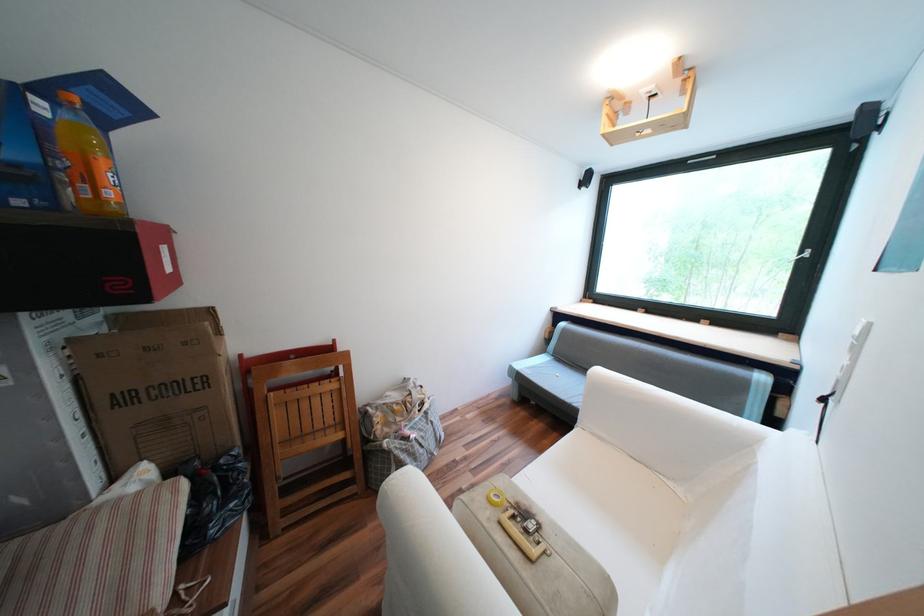
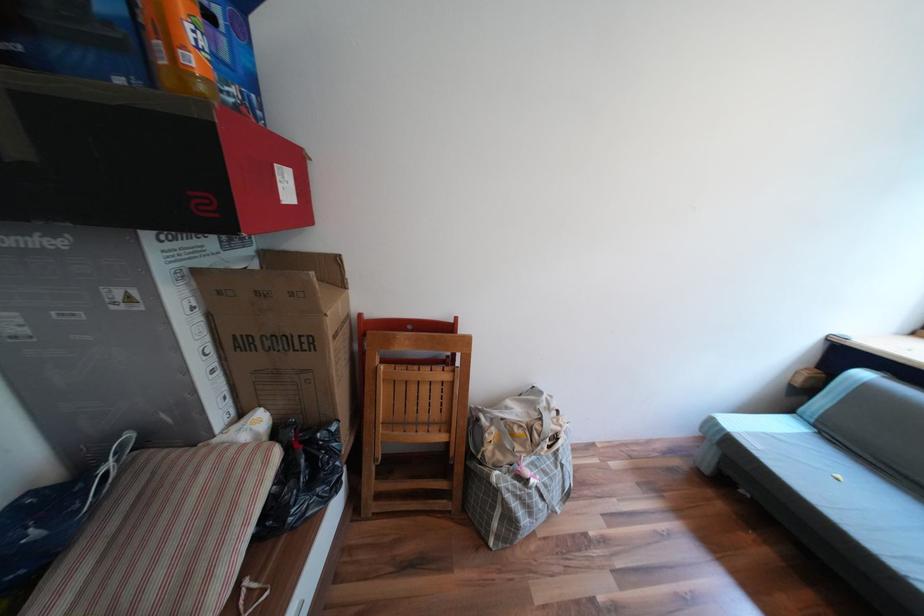
The point at (89, 415) is marked in the first image. Where is the corresponding point in the second image?

(219, 349)